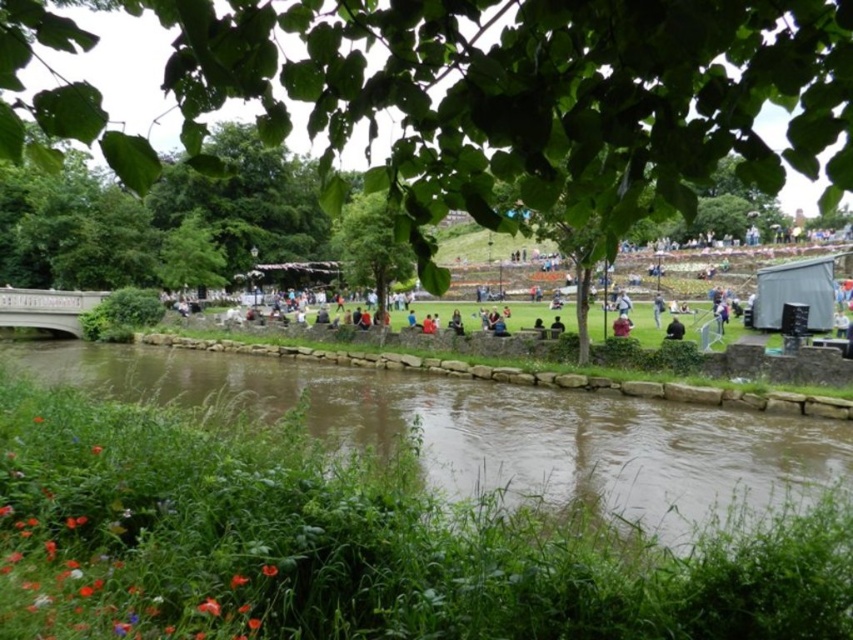
You are a hiker who wants to take a photo of both the green leafy tree at upper center and the green leafy tree at center in the same frame. Which tree should you stand closer to in order to include both in your photo?

To include both the green leafy tree at upper center and the green leafy tree at center in the same frame, you should stand closer to the green leafy tree at center since it is shorter than the green leafy tree at upper center.

You are standing at the center of the image and want to locate the brown stone river at lower center. According to the coordinates provided, in which direction should you look to find it?

You should look to the lower center direction to find the brown stone river at lower center, as it is located at coordinates point (x=497, y=429).